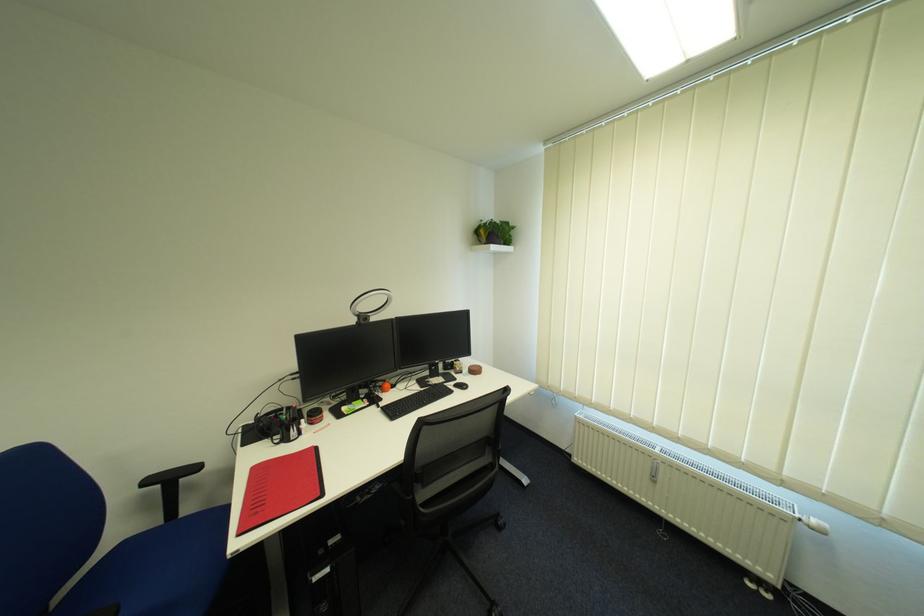
Find where to turn the radiator knob. Please return your answer as a coordinate pair (x, y).

(663, 477)